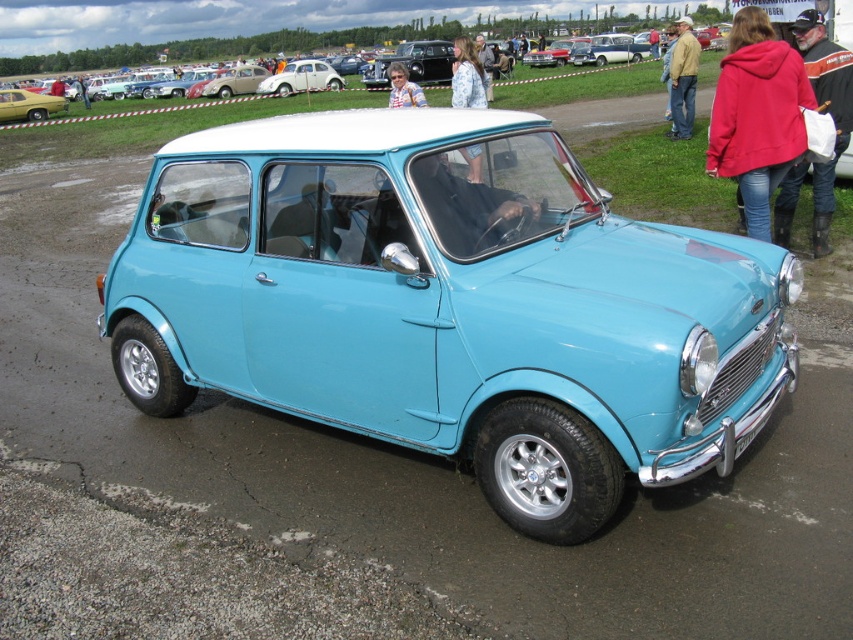
Question: Which point is closer to the camera?

Choices:
 (A) beige matte vintage car at upper left
 (B) red jacket at upper right
 (C) yellow glossy car at upper left
 (D) light blue metallic car at center

Answer: (D)

Question: Does light blue metallic car at center appear on the left side of red jacket at upper right?

Choices:
 (A) no
 (B) yes

Answer: (B)

Question: Is light blue metallic car at center above yellow glossy car at upper left?

Choices:
 (A) yes
 (B) no

Answer: (B)

Question: Which of these objects is positioned farthest from the red fleece jacket at upper right?

Choices:
 (A) light blue metallic car at center
 (B) beige matte vintage car at upper left
 (C) red jacket at upper right

Answer: (B)

Question: Which object is the farthest from the metallic silver car at center?

Choices:
 (A) light brown leather jacket at center
 (B) shiny black car at upper center

Answer: (A)

Question: Does beige matte vintage car at upper left appear over light brown leather jacket at center?

Choices:
 (A) no
 (B) yes

Answer: (B)